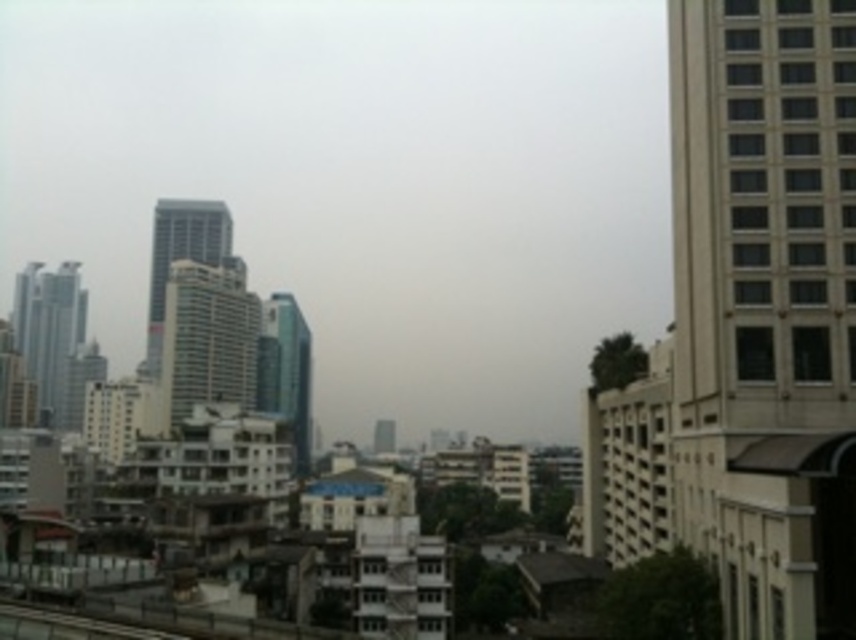
Question: Which object appears closest to the camera in this image?

Choices:
 (A) white glass building at center
 (B) glassy steel skyscraper at left
 (C) beige smooth building at right
 (D) glassy teal skyscraper at center

Answer: (C)

Question: Where is white glass building at center located in relation to glassy blue skyscraper at center-left in the image?

Choices:
 (A) above
 (B) below

Answer: (B)

Question: Among these points, which one is nearest to the camera?

Choices:
 (A) (42, 273)
 (B) (694, 157)
 (C) (207, 328)
 (D) (278, 337)

Answer: (B)

Question: Does beige smooth building at right have a lesser width compared to white glass building at center?

Choices:
 (A) yes
 (B) no

Answer: (A)

Question: Which point is farther to the camera?

Choices:
 (A) (223, 216)
 (B) (217, 273)
 (C) (263, 337)

Answer: (A)

Question: Can you confirm if beige smooth building at right is positioned above glassy blue skyscraper at center-left?

Choices:
 (A) yes
 (B) no

Answer: (B)